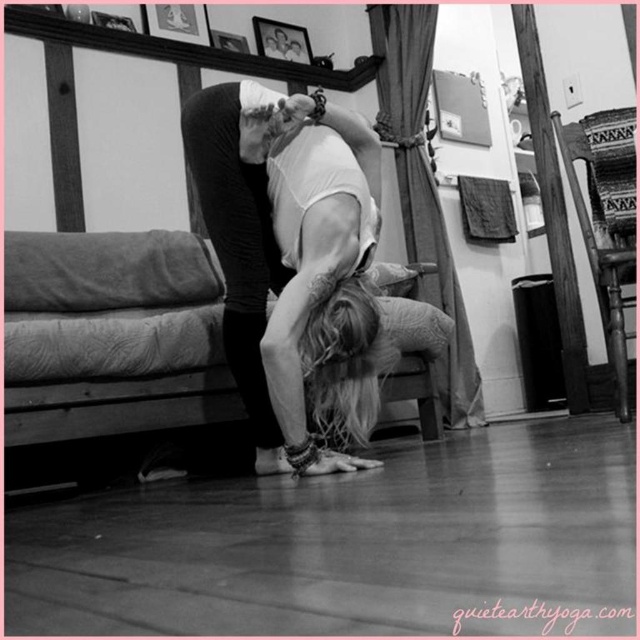
You are standing at point (278, 240) and want to reach the yoga instructor who is 1.77 meters away. Can you walk straight to them without any obstacles?

Yes, since there are no objects mentioned in the scene besides the two people, you can walk straight to the yoga instructor at 1.77 meters away.

You are a photographer trying to capture the scene from the front. You need to adjust your camera to focus on both the white fabric at center and the wooden picture frame at upper center. Which object should you focus on first to ensure proper depth of field?

The white fabric at center should be focused on first because it has a greater height compared to the wooden picture frame at upper center, ensuring the larger object is in focus before adjusting for the smaller one.